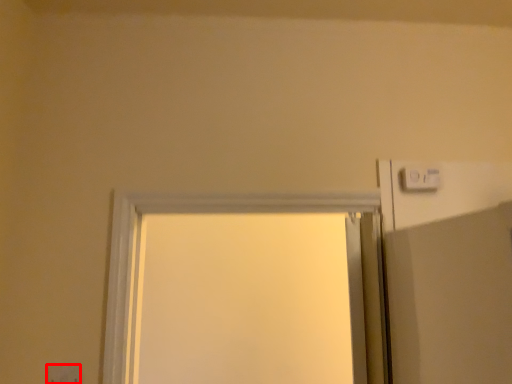
Question: From the image's perspective, what is the correct spatial relationship of electric outlet (annotated by the red box) in relation to light switch?

Choices:
 (A) above
 (B) below

Answer: (B)